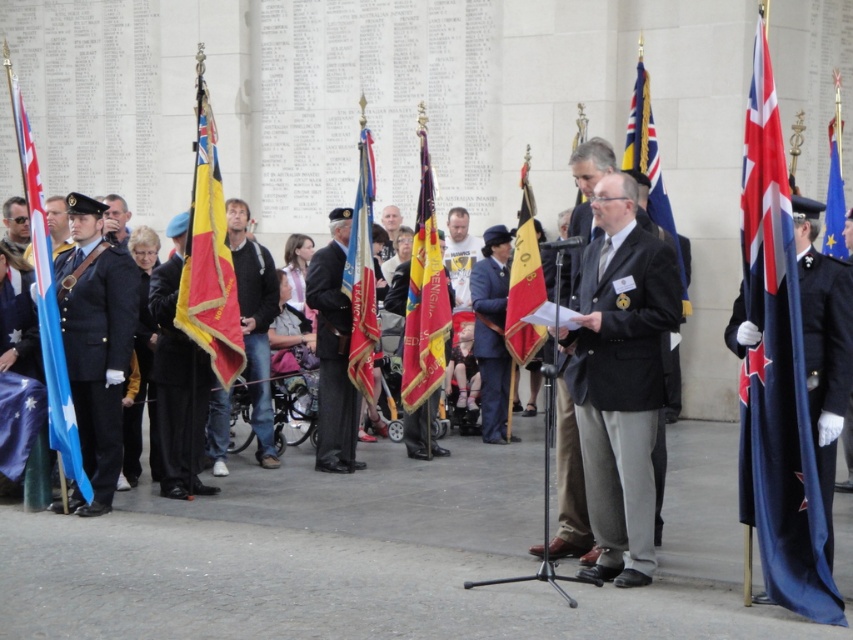
How much distance is there between black fabric uniform at center and maroon velvet flag at center?

black fabric uniform at center is 3.22 meters away from maroon velvet flag at center.

Is point (178, 385) farther from camera compared to point (402, 403)?

No, (178, 385) is closer to viewer.

I want to click on black fabric uniform at center, so click(x=177, y=388).

Can you confirm if red fabric flag at center is taller than blue fabric uniform at center?

Yes.

This screenshot has height=640, width=853. I want to click on red fabric flag at center, so click(x=361, y=276).

Is red/yellow fabric flag at center positioned at the back of black fabric suit at center?

No.

Who is higher up, red/yellow fabric flag at center or black fabric suit at center?

red/yellow fabric flag at center is above.

Describe the element at coordinates (209, 259) in the screenshot. I see `red/yellow fabric flag at center` at that location.

Find the location of a particular element. The image size is (853, 640). red/yellow fabric flag at center is located at coordinates (209, 259).